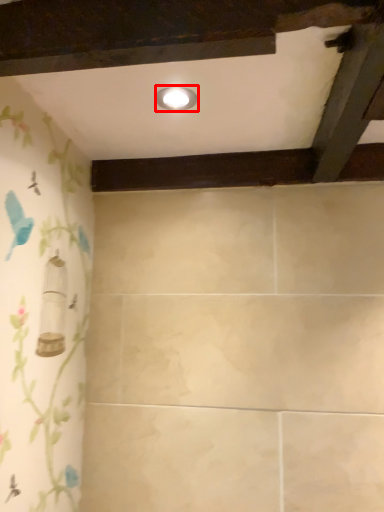
Question: In this image, where is light fixture (annotated by the red box) located relative to plank?

Choices:
 (A) right
 (B) left

Answer: (B)